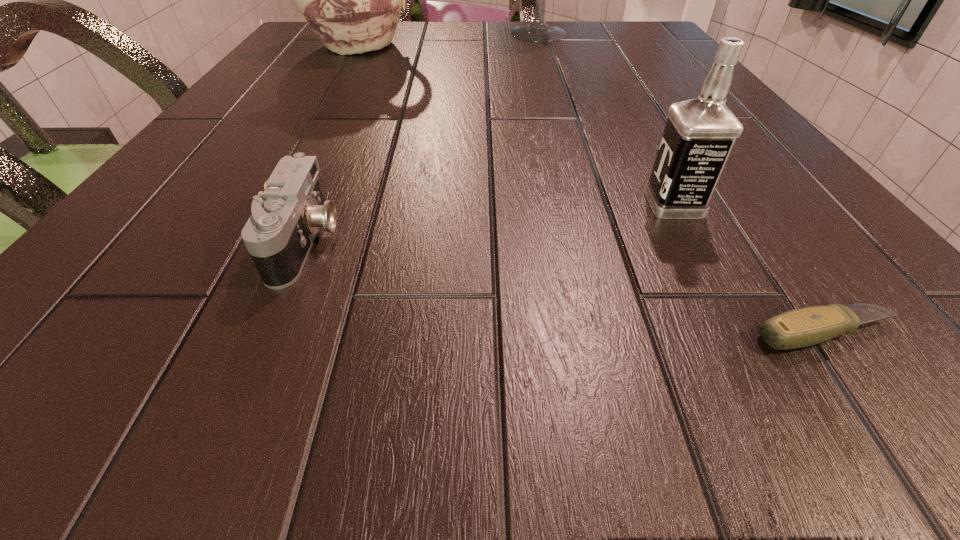
Locate an element on the screen. free space between the vodka and the pocketknife is located at coordinates (750, 268).

Where is `free space between the camera and the vodka`? This screenshot has height=540, width=960. free space between the camera and the vodka is located at coordinates (490, 222).

Locate an element on the screen. The height and width of the screenshot is (540, 960). free spot between the second shortest object and the shortest object is located at coordinates (565, 287).

Locate an element on the screen. The height and width of the screenshot is (540, 960). vacant space that is in between the pitcher and the third object from left to right is located at coordinates (452, 39).

Identify which object is the second nearest to the pitcher. Please provide its 2D coordinates. Your answer should be formatted as a tuple, i.e. [(x, y)], where the tuple contains the x and y coordinates of a point satisfying the conditions above.

[(286, 217)]

This screenshot has height=540, width=960. I want to click on object that ranks as the third closest to the camera, so click(x=352, y=0).

This screenshot has width=960, height=540. I want to click on free spot that satisfies the following two spatial constraints: 1. on the front label of the vodka; 2. on the back side of the shortest object, so click(x=741, y=333).

Where is `free space that satisfies the following two spatial constraints: 1. on the front label of the vodka; 2. on the right side of the shortest object`? free space that satisfies the following two spatial constraints: 1. on the front label of the vodka; 2. on the right side of the shortest object is located at coordinates (741, 333).

I want to click on vacant area in the image that satisfies the following two spatial constraints: 1. on the spout of the pitcher; 2. on the back side of the nearest object, so click(x=207, y=333).